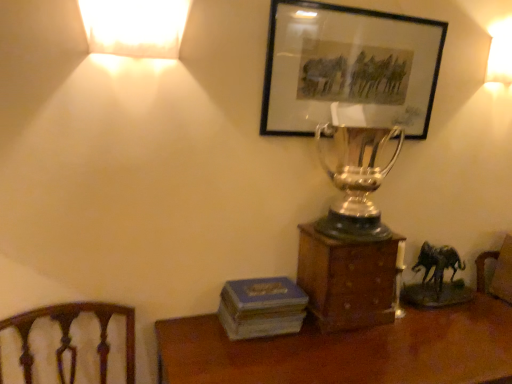
Question: From the image's perspective, is matte white lampshade at upper right, the first lamp in the back-to-front sequence, on wooden box at center?

Choices:
 (A) no
 (B) yes

Answer: (B)

Question: Are matte white lampshade at upper right, the first lamp in the back-to-front sequence, and wooden box at center far apart?

Choices:
 (A) yes
 (B) no

Answer: (A)

Question: From the image's perspective, is matte white lampshade at upper right, the 2th lamp positioned from the left, below wooden box at center?

Choices:
 (A) yes
 (B) no

Answer: (B)

Question: From a real-world perspective, is matte white lampshade at upper right, the 2th lamp viewed from the front, physically below wooden box at center?

Choices:
 (A) no
 (B) yes

Answer: (A)

Question: Can you confirm if matte white lampshade at upper right, the 2th lamp positioned from the left, is wider than wooden box at center?

Choices:
 (A) yes
 (B) no

Answer: (B)

Question: In the image, is shiny silver trophy at center positioned in front of or behind wooden box at center?

Choices:
 (A) behind
 (B) front

Answer: (B)

Question: Does point (338, 231) appear closer or farther from the camera than point (331, 241)?

Choices:
 (A) farther
 (B) closer

Answer: (A)

Question: In terms of width, does shiny silver trophy at center look wider or thinner when compared to wooden box at center?

Choices:
 (A) wide
 (B) thin

Answer: (B)

Question: Considering the positions of shiny silver trophy at center and wooden box at center in the image, is shiny silver trophy at center taller or shorter than wooden box at center?

Choices:
 (A) tall
 (B) short

Answer: (A)

Question: Is blue matte book at lower center in front of or behind shiny silver trophy at center in the image?

Choices:
 (A) behind
 (B) front

Answer: (A)

Question: Considering the positions of point (291, 314) and point (368, 173), is point (291, 314) closer or farther from the camera than point (368, 173)?

Choices:
 (A) closer
 (B) farther

Answer: (B)

Question: Would you say blue matte book at lower center is to the left or to the right of shiny silver trophy at center in the picture?

Choices:
 (A) left
 (B) right

Answer: (A)

Question: From a real-world perspective, relative to shiny silver trophy at center, is blue matte book at lower center vertically above or below?

Choices:
 (A) above
 (B) below

Answer: (B)

Question: Is point (245, 317) closer or farther from the camera than point (441, 355)?

Choices:
 (A) farther
 (B) closer

Answer: (A)

Question: Is blue matte book at lower center inside or outside of wooden desk at lower center?

Choices:
 (A) inside
 (B) outside

Answer: (B)